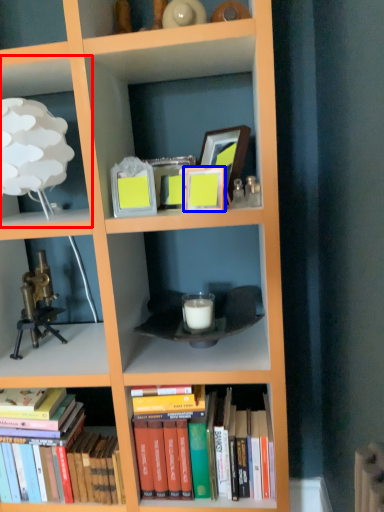
Question: Which of the following is the farthest to the observer, shelf (highlighted by a red box) or picture frame (highlighted by a blue box)?

Choices:
 (A) shelf
 (B) picture frame

Answer: (B)